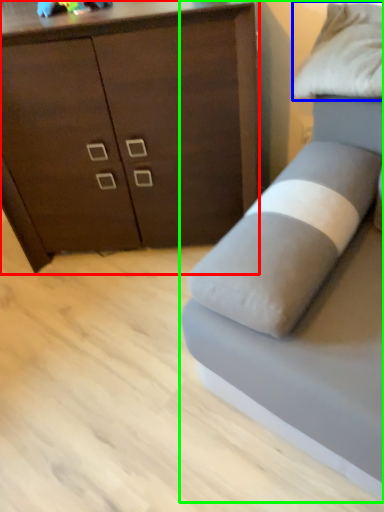
Question: Which object is positioned farthest from chest of drawers (highlighted by a red box)? Select from pillow (highlighted by a blue box) and studio couch (highlighted by a green box).

Choices:
 (A) pillow
 (B) studio couch

Answer: (B)